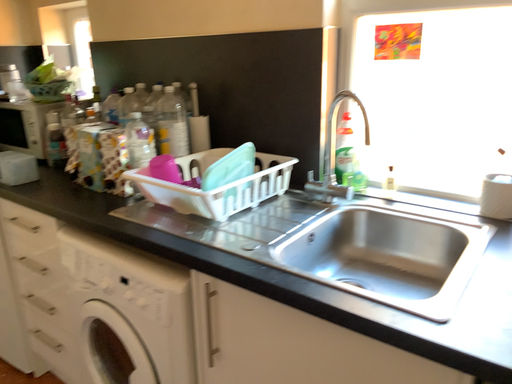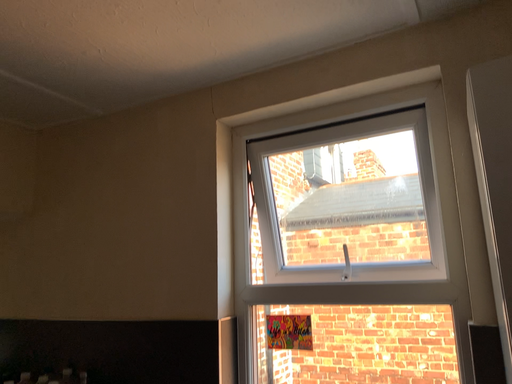
Question: Which way did the camera rotate in the video?

Choices:
 (A) rotated downward
 (B) rotated upward

Answer: (B)